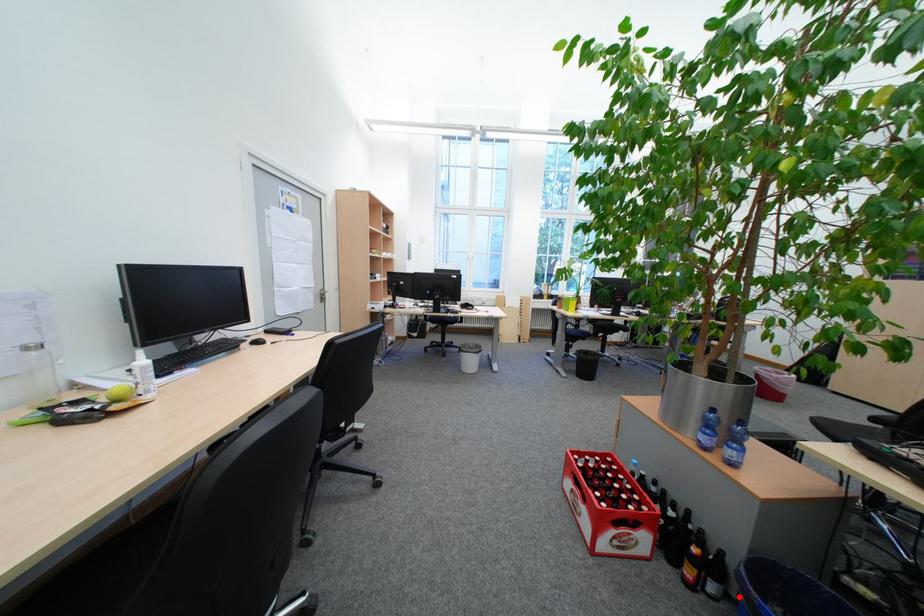
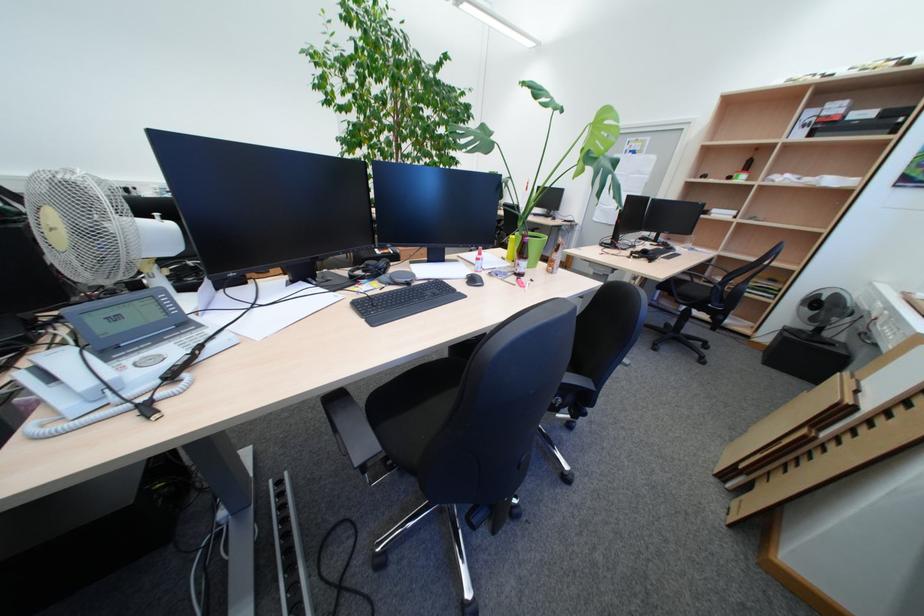
Question: I am providing you with two images of the same scene from different viewpoints. A red point is marked on the first image. At the location where the point appears in image 1, is it still visible in image 2?

Choices:
 (A) Yes
 (B) No

Answer: (B)